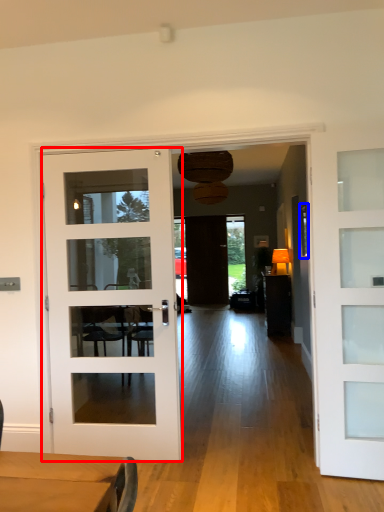
Question: Which of the following is the closest to the observer, door (highlighted by a red box) or window (highlighted by a blue box)?

Choices:
 (A) door
 (B) window

Answer: (A)